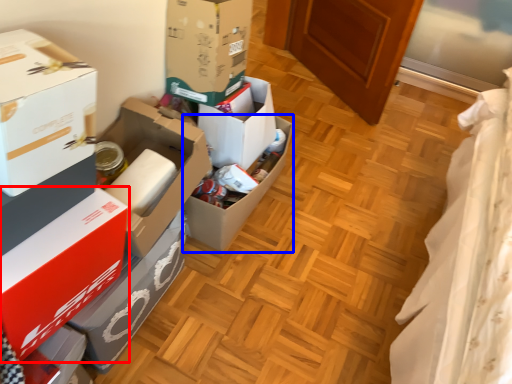
Question: Which point is closer to the camera, box (highlighted by a red box) or box (highlighted by a blue box)?

Choices:
 (A) box
 (B) box

Answer: (A)